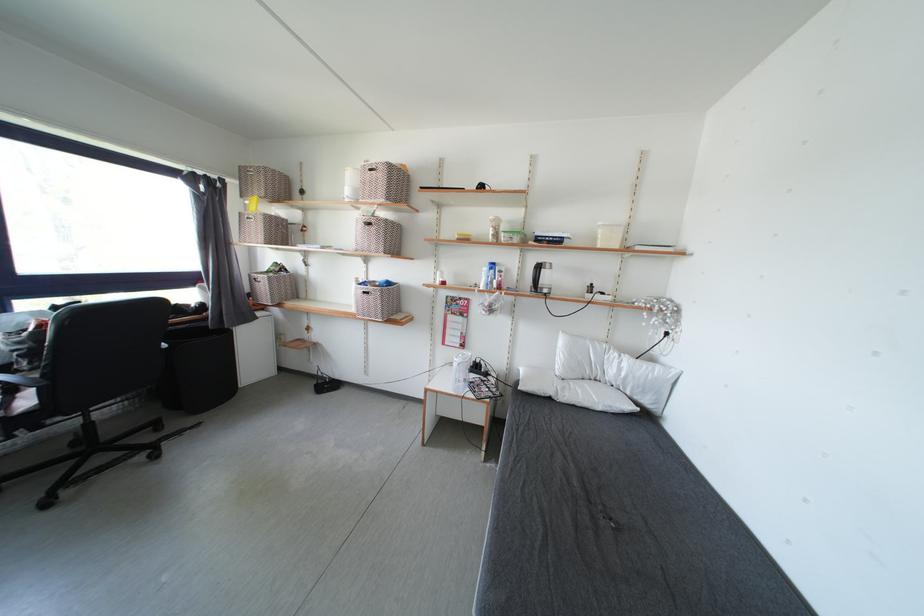
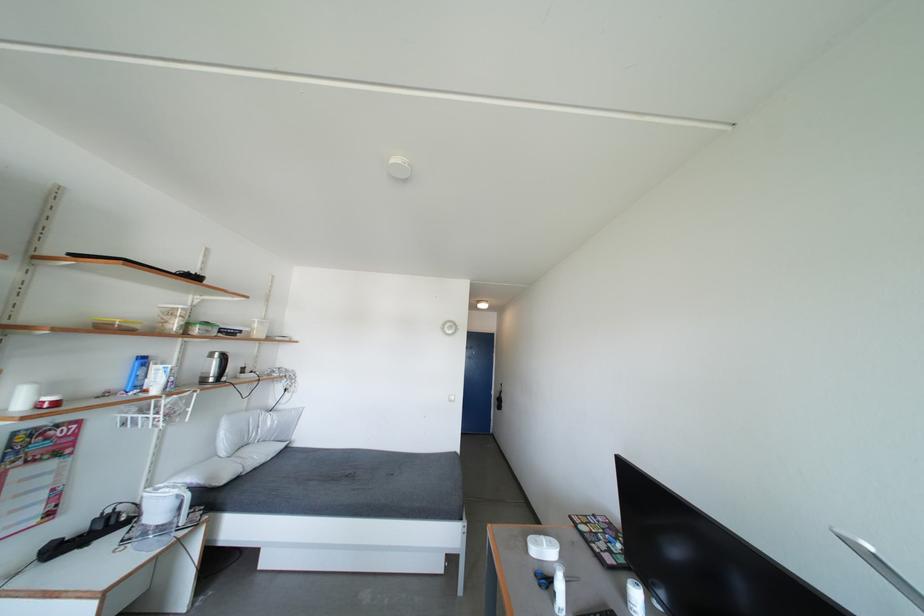
Locate, in the second image, the point that corresponds to (565,355) in the first image.

(228, 439)